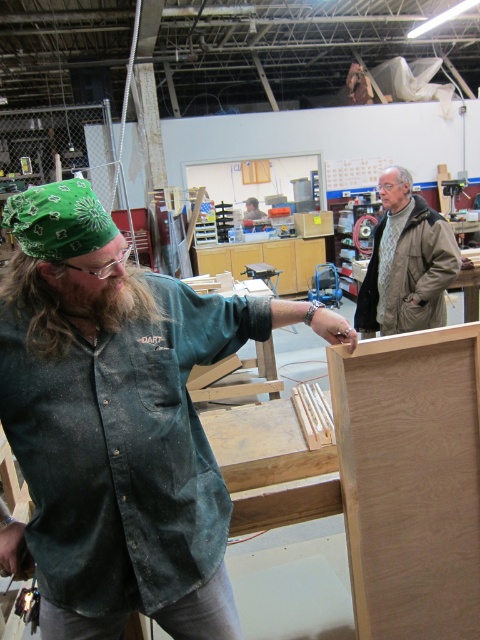
From the picture: Based on the scene description, which object is closer to the viewer between the dark green corduroy shirt at left and the gray wool sweater at upper right?

The dark green corduroy shirt at left is closer to the viewer because it is in front of the gray wool sweater at upper right.

What is located at the point with coordinates (410,481) in the workshop scene?

The point at coordinates (410,481) indicates the location of the bare wood board at center.